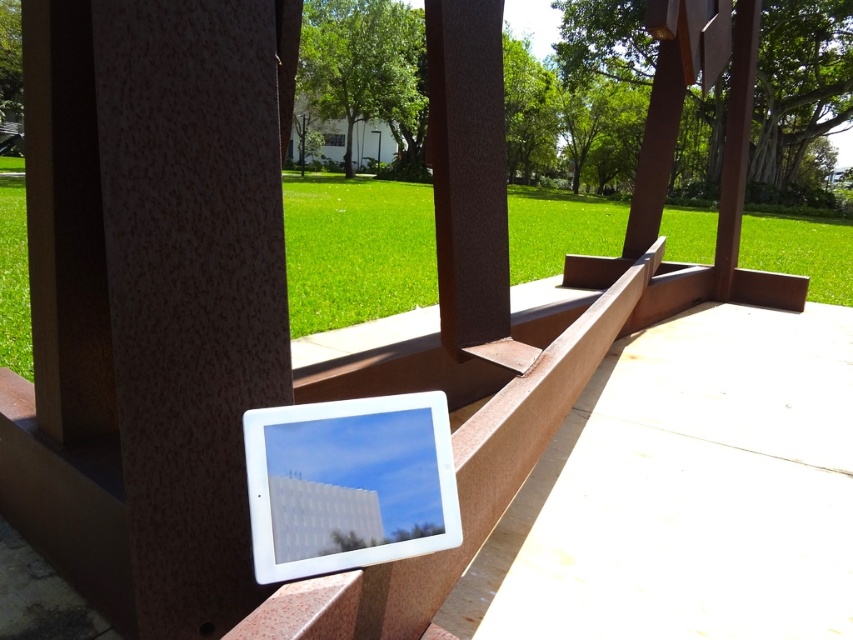
Can you confirm if green grass at center is positioned to the right of white glossy tablet at center?

No, green grass at center is not to the right of white glossy tablet at center.

What do you see at coordinates (357, 250) in the screenshot? The width and height of the screenshot is (853, 640). I see `green grass at center` at bounding box center [357, 250].

The image size is (853, 640). Describe the element at coordinates (357, 250) in the screenshot. I see `green grass at center` at that location.

You are a GUI agent. You are given a task and a screenshot of the screen. Output one action in this format:
    pyautogui.click(x=<x>, y=<y>)
    Task: Click on the green grass at center
    The image size is (853, 640).
    Given the screenshot: What is the action you would take?
    pyautogui.click(x=357, y=250)

Can you confirm if green grass at center is positioned to the right of brown matte wood at center?

No, green grass at center is not to the right of brown matte wood at center.

Is green grass at center above brown matte wood at center?

Yes.

Is point (828, 292) less distant than point (486, 317)?

No, (828, 292) is further to viewer.

Image resolution: width=853 pixels, height=640 pixels. I want to click on green grass at center, so click(357, 250).

Is white glossy tablet at center thinner than brown matte wood at center?

Incorrect, white glossy tablet at center's width is not less than brown matte wood at center's.

Who is taller, white glossy tablet at center or brown matte wood at center?

Standing taller between the two is brown matte wood at center.

Which is behind, point (312, 566) or point (494, 28)?

The point (494, 28) is behind.

Locate an element on the screen. This screenshot has width=853, height=640. white glossy tablet at center is located at coordinates (349, 483).